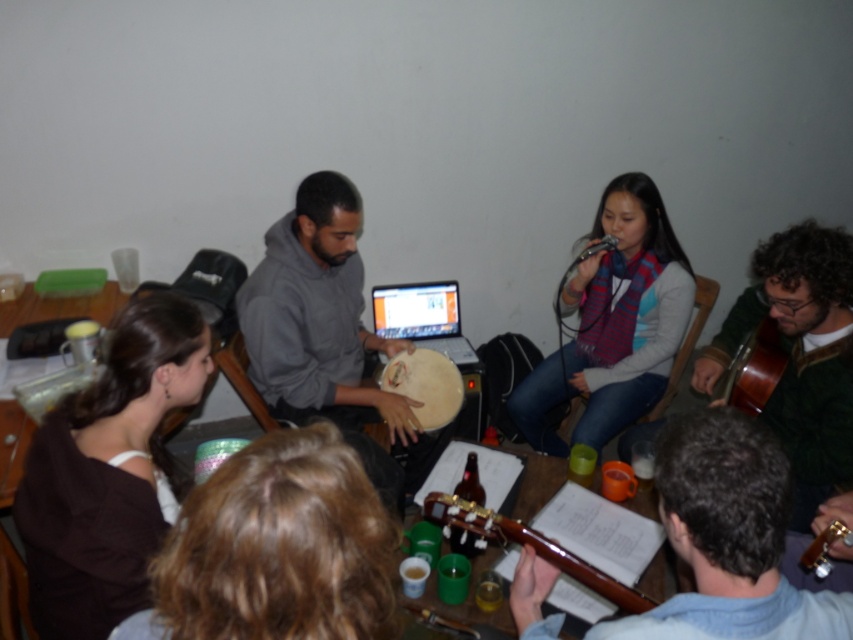
Question: Can you confirm if brown curly hair at lower center is bigger than striped scarf at center?

Choices:
 (A) no
 (B) yes

Answer: (A)

Question: Can you confirm if wooden acoustic guitar at lower center is smaller than wooden table at lower left?

Choices:
 (A) yes
 (B) no

Answer: (A)

Question: In this image, where is wooden acoustic guitar at lower center located relative to wooden table at lower left?

Choices:
 (A) above
 (B) below

Answer: (B)

Question: Which point is closer to the camera?

Choices:
 (A) brown fabric shirt at lower left
 (B) brown wooden guitar at right
 (C) matte wooden drum at center
 (D) wooden table at lower left

Answer: (A)

Question: Which object appears closest to the camera in this image?

Choices:
 (A) brown leather guitar at lower center
 (B) matte black laptop at center

Answer: (A)

Question: Estimate the real-world distances between objects in this image. Which object is closer to the gray matte hoodie at center?

Choices:
 (A) matte wooden drum at center
 (B) brown wooden guitar at right
 (C) striped scarf at center
 (D) matte black laptop at center

Answer: (A)